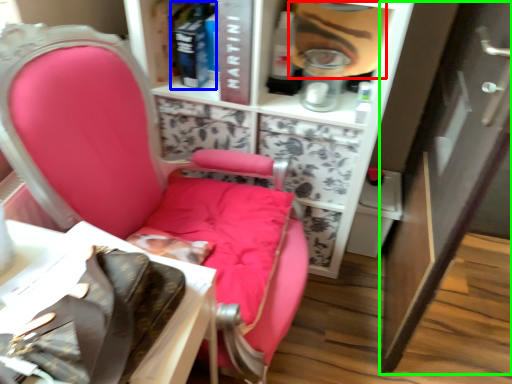
Question: Based on their relative distances, which object is farther from person (highlighted by a red box)? Choose from book (highlighted by a blue box) and cabinetry (highlighted by a green box).

Choices:
 (A) book
 (B) cabinetry

Answer: (B)